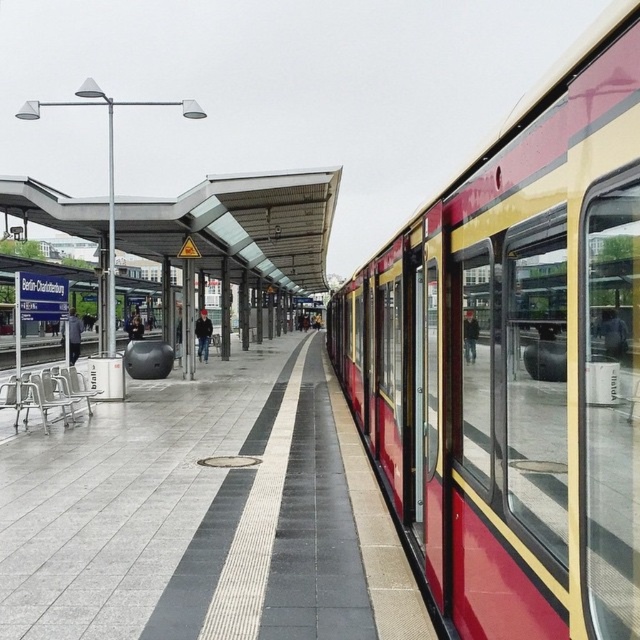
Question: Does red glossy train at right appear over concrete platform at center?

Choices:
 (A) yes
 (B) no

Answer: (A)

Question: Which point appears closest to the camera in this image?

Choices:
 (A) (140, 480)
 (B) (474, 307)

Answer: (B)

Question: Is red glossy train at right thinner than concrete platform at center?

Choices:
 (A) no
 (B) yes

Answer: (B)

Question: Can you confirm if red glossy train at right is bigger than concrete platform at center?

Choices:
 (A) yes
 (B) no

Answer: (A)